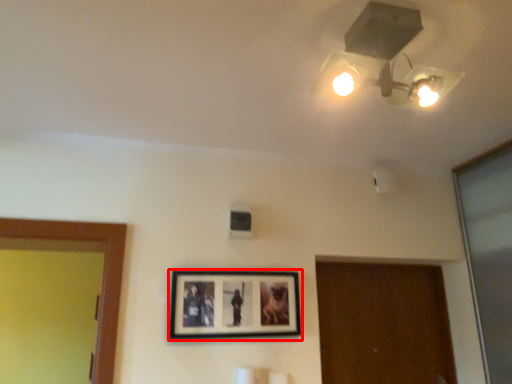
Question: Observing the image, what is the correct spatial positioning of picture frame (annotated by the red box) in reference to lamp?

Choices:
 (A) right
 (B) left

Answer: (B)